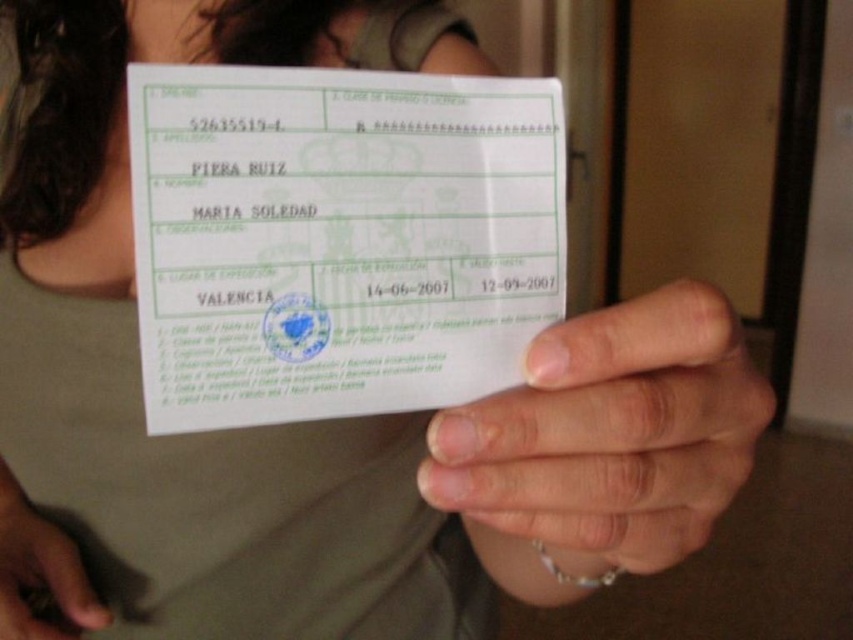
You are a photographer adjusting the focus of a camera. You need to ensure that both points, point (418, 384) and point (76, 605), are in focus. Since the camera can only focus on one plane, which point should you prioritize focusing on to ensure at least one is sharp?

You should prioritize focusing on point (418, 384) because it is closer to the viewer than point (76, 605), so it will be in focus first.

You are a delivery person who needs to scan a receipt to complete a delivery. You have a scanner that requires the receipt to be placed exactly 12 inches away from the camera. The receipt is currently at the white paper receipt at center. Can you scan it without moving the receipt?

The white paper receipt at center is currently 11.23 inches away from the camera. Since the scanner requires it to be exactly 12 inches away, you need to move the receipt slightly further back to reach the required distance.